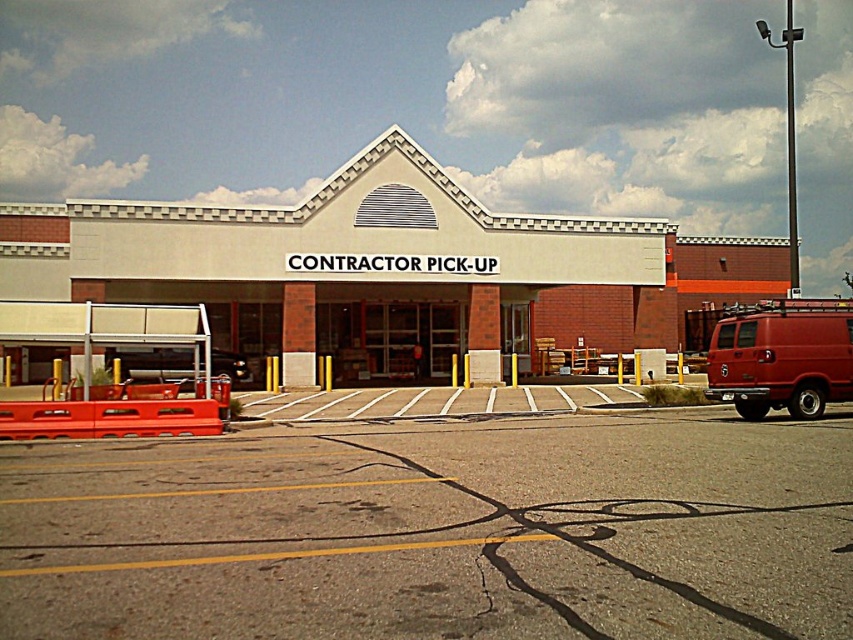
Question: Is matte red van at right positioned at the back of metallic silver car at lower left?

Choices:
 (A) yes
 (B) no

Answer: (B)

Question: Is white brick mall at center positioned behind matte red van at right?

Choices:
 (A) yes
 (B) no

Answer: (A)

Question: Which point is farther from the camera taking this photo?

Choices:
 (A) (144, 486)
 (B) (639, 324)
 (C) (183, 376)
 (D) (775, 358)

Answer: (B)

Question: Considering the relative positions of gray asphalt parking lot at center and white brick mall at center in the image provided, where is gray asphalt parking lot at center located with respect to white brick mall at center?

Choices:
 (A) below
 (B) above

Answer: (A)

Question: Which object appears closest to the camera in this image?

Choices:
 (A) metallic silver car at lower left
 (B) gray asphalt parking lot at center
 (C) white brick mall at center

Answer: (B)

Question: Which object is closer to the camera taking this photo?

Choices:
 (A) matte red van at right
 (B) gray asphalt parking lot at center
 (C) white brick mall at center
 (D) metallic silver car at lower left

Answer: (B)